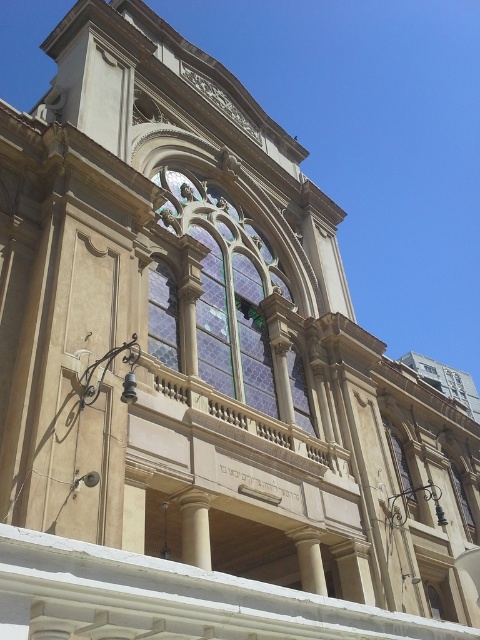
Based on the photo, you are an architect designing a new building and want to incorporate two stained glass windows. You observe the scene and notice the stained glass window at center and the stained glass window at upper center. Which of these two windows is wider?

→ The stained glass window at center is wider than the stained glass window at upper center because its width surpasses the other as stated in the description.

You are an architect examining the building and need to determine which stained glass window is bigger. Based on the image, which one is larger between the stained glass window at center and the stained glass window at upper center?

The stained glass window at center is larger in size than the stained glass window at upper center.